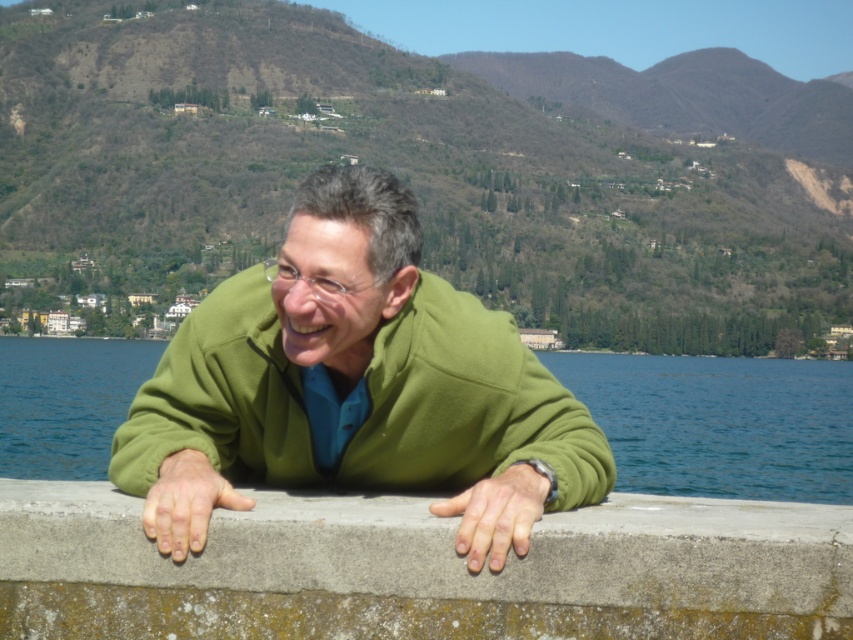
You are a photographer planning to take a portrait of the man in the green matte jacket at center. To ensure the jacket is the main focus, you need to adjust the camera settings so that the gray concrete ledge at center does not overpower the image. Based on their sizes, which object should you prioritize in terms of size when framing the shot?

The green matte jacket at center is bigger than the gray concrete ledge at center, so to make the jacket the main focus, you should frame the shot to emphasize its larger size compared to the ledge.